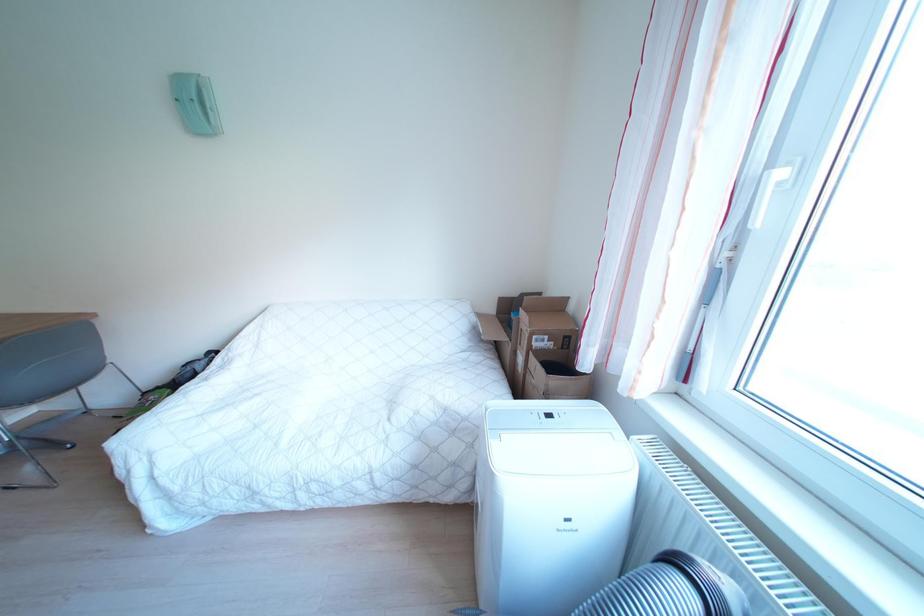
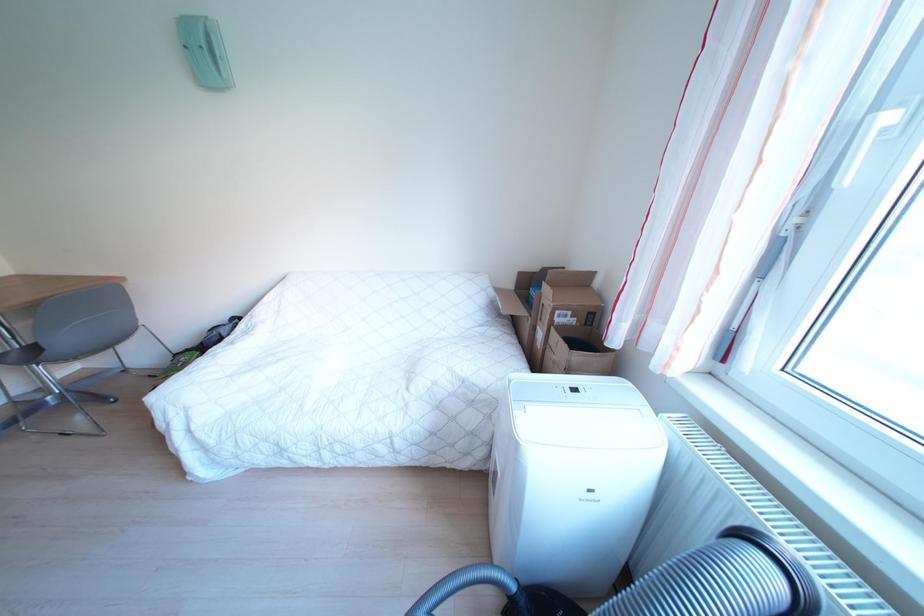
In a continuous first-person perspective shot, in which direction is the camera moving?

The cameraman moved toward left, forward.